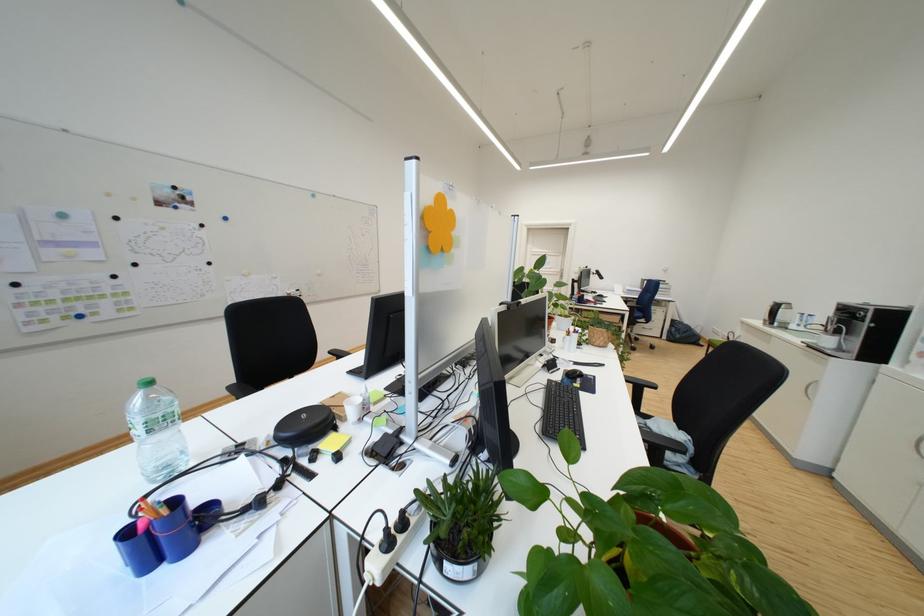
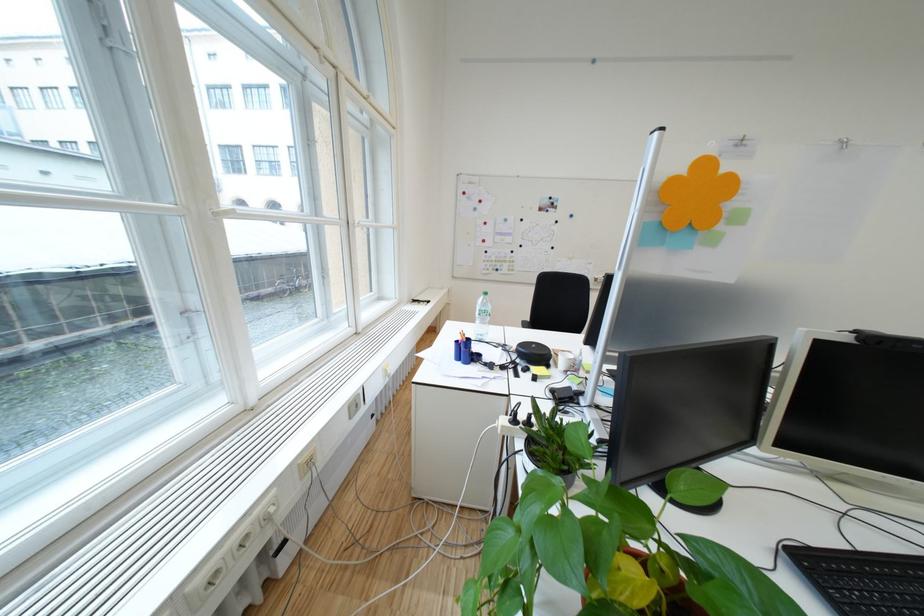
Find the pixel in the second image that matches point 150,423 in the first image.

(490, 310)